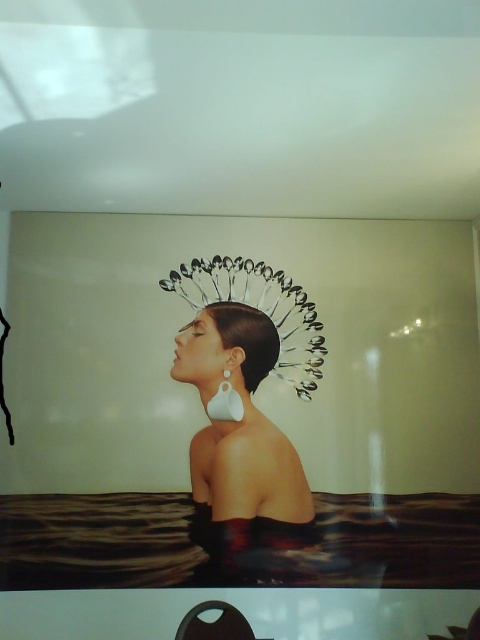
Does silver metallic spoons at upper center have a lesser height compared to white matte earring at center?

No.

Who is more distant from viewer, [301,307] or [228,369]?

Positioned behind is point [301,307].

You are a GUI agent. You are given a task and a screenshot of the screen. Output one action in this format:
    pyautogui.click(x=<x>, y=<y>)
    Task: Click on the silver metallic spoons at upper center
    This screenshot has width=480, height=640.
    Given the screenshot: What is the action you would take?
    pyautogui.click(x=260, y=310)

The width and height of the screenshot is (480, 640). Identify the location of silver metallic spoons at upper center. (260, 310).

Is white matte crown at center positioned at the back of silver metallic spoons at upper center?

That is False.

Who is positioned more to the right, white matte crown at center or silver metallic spoons at upper center?

Positioned to the right is silver metallic spoons at upper center.

Between point (180, 348) and point (228, 289), which one is positioned in front?

Point (180, 348) is in front.

Where is `white matte crown at center`? This screenshot has width=480, height=640. white matte crown at center is located at coordinates (245, 403).

Is white matte crown at center further to the viewer compared to white matte earring at center?

No, it is in front of white matte earring at center.

Between point (208, 456) and point (223, 371), which one is positioned behind?

The point (223, 371) is more distant.

The image size is (480, 640). In order to click on white matte crown at center in this screenshot , I will do `click(245, 403)`.